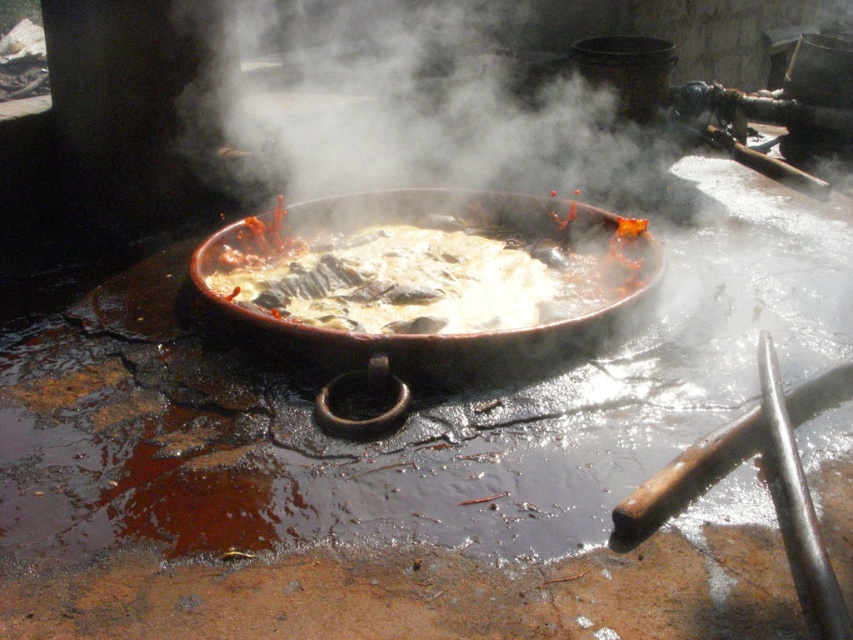
Question: Among these objects, which one is nearest to the camera?

Choices:
 (A) shiny black wok at center
 (B) white vapor at center

Answer: (A)

Question: Where is shiny black wok at center located in relation to white vapor at center in the image?

Choices:
 (A) left
 (B) right

Answer: (B)

Question: Which object is closer to the camera taking this photo?

Choices:
 (A) white vapor at center
 (B) shiny black wok at center

Answer: (B)

Question: Is shiny black wok at center smaller than white vapor at center?

Choices:
 (A) no
 (B) yes

Answer: (B)

Question: Which of the following is the closest to the observer?

Choices:
 (A) shiny black wok at center
 (B) white vapor at center

Answer: (A)

Question: Is shiny black wok at center to the right of white vapor at center from the viewer's perspective?

Choices:
 (A) yes
 (B) no

Answer: (A)